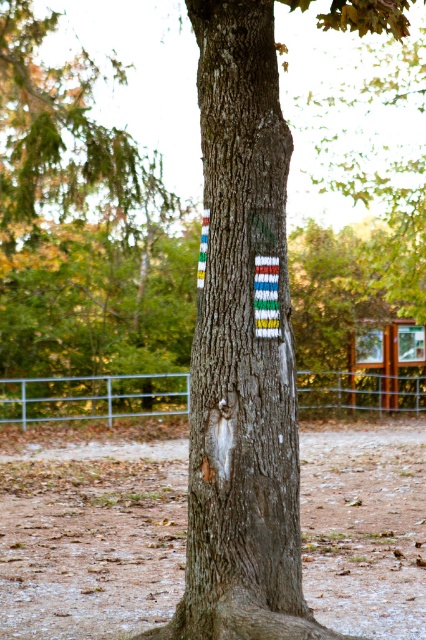
You are standing in front of the tree trunk with the colorful stripes. You notice two points marked on the trunk at coordinates point (397, 497) and point (322, 406). Which point is nearer to your eyes?

Point (397, 497) is closer to the camera than point (322, 406).

You are standing in a forest clearing and see the smooth bark tree trunk at center and the metallic silver fence at lower center. Which object is higher up from the ground?

The smooth bark tree trunk at center is above the metallic silver fence at lower center, so it is higher up from the ground.